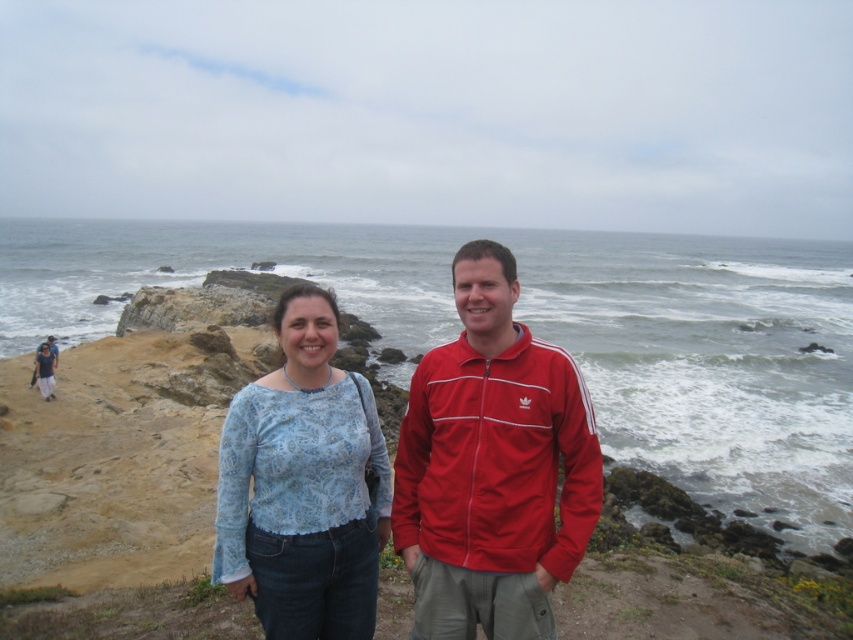
Who is more distant from viewer, (590, 492) or (368, 499)?

Point (368, 499)

Who is taller, red adidas track jacket at center or paisley-patterned blouse at center?

red adidas track jacket at center

Is point (502, 381) less distant than point (367, 484)?

Yes, it is in front of point (367, 484).

Find the location of a particular element. Image resolution: width=853 pixels, height=640 pixels. red adidas track jacket at center is located at coordinates (492, 467).

Is white foamy water at center to the left of red adidas track jacket at center from the viewer's perspective?

In fact, white foamy water at center is to the right of red adidas track jacket at center.

Who is lower down, white foamy water at center or red adidas track jacket at center?

red adidas track jacket at center is below.

Describe the element at coordinates (544, 332) in the screenshot. I see `white foamy water at center` at that location.

This screenshot has height=640, width=853. I want to click on white foamy water at center, so click(544, 332).

Which is more to the right, white foamy water at center or paisley-patterned blouse at center?

From the viewer's perspective, white foamy water at center appears more on the right side.

Does point (108, 284) lie in front of point (306, 307)?

That is False.

Where is `white foamy water at center`? The height and width of the screenshot is (640, 853). white foamy water at center is located at coordinates (544, 332).